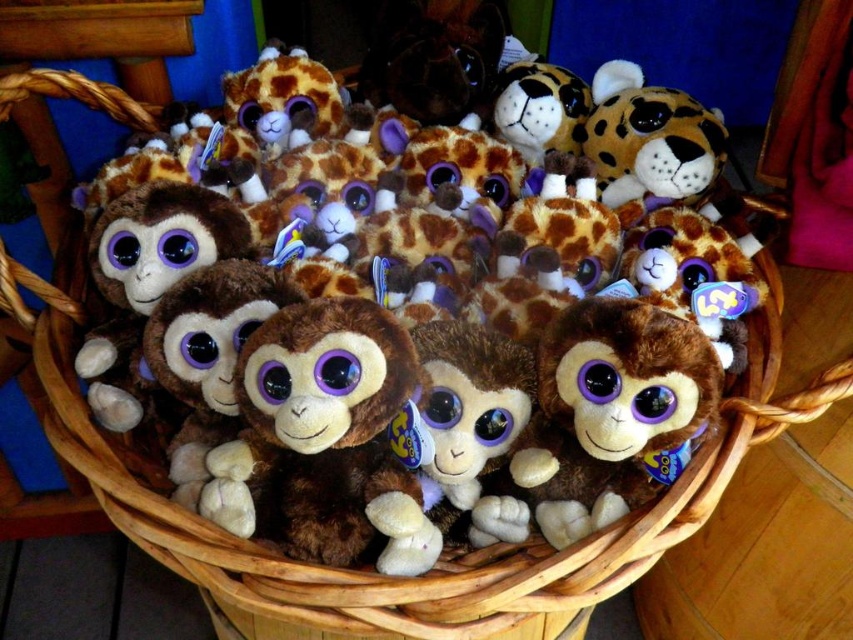
Question: From the image, what is the correct spatial relationship of brown plush monkey at center in relation to spotted brown plush at upper right?

Choices:
 (A) right
 (B) left

Answer: (B)

Question: Which object is closer to the camera taking this photo?

Choices:
 (A) spotted brown plush at upper right
 (B) brown plush monkey at center

Answer: (B)

Question: Which object appears closest to the camera in this image?

Choices:
 (A) brown plush monkey at center
 (B) spotted brown plush at upper right

Answer: (A)

Question: Does brown plush monkey at center appear on the left side of spotted brown plush at upper right?

Choices:
 (A) no
 (B) yes

Answer: (B)

Question: Can you confirm if brown plush monkey at center is thinner than spotted brown plush at upper right?

Choices:
 (A) no
 (B) yes

Answer: (A)